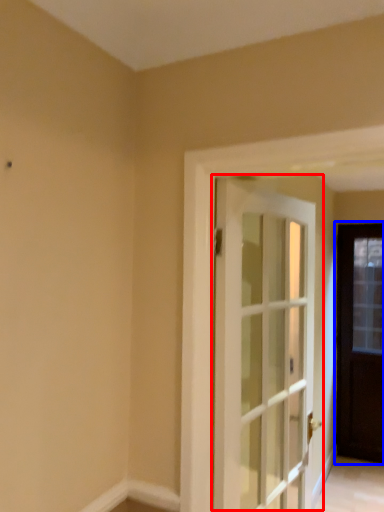
Question: Which point is closer to the camera, door (highlighted by a red box) or door (highlighted by a blue box)?

Choices:
 (A) door
 (B) door

Answer: (A)